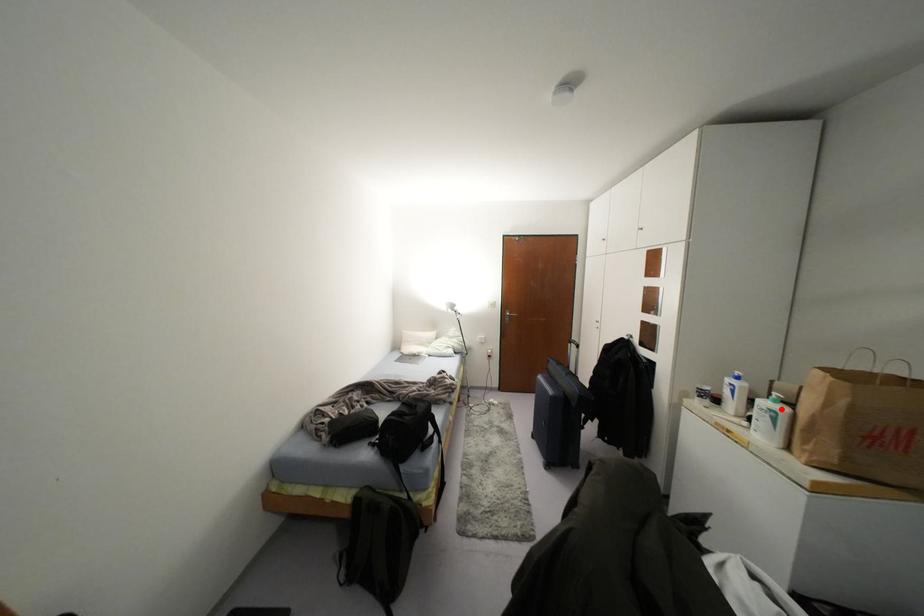
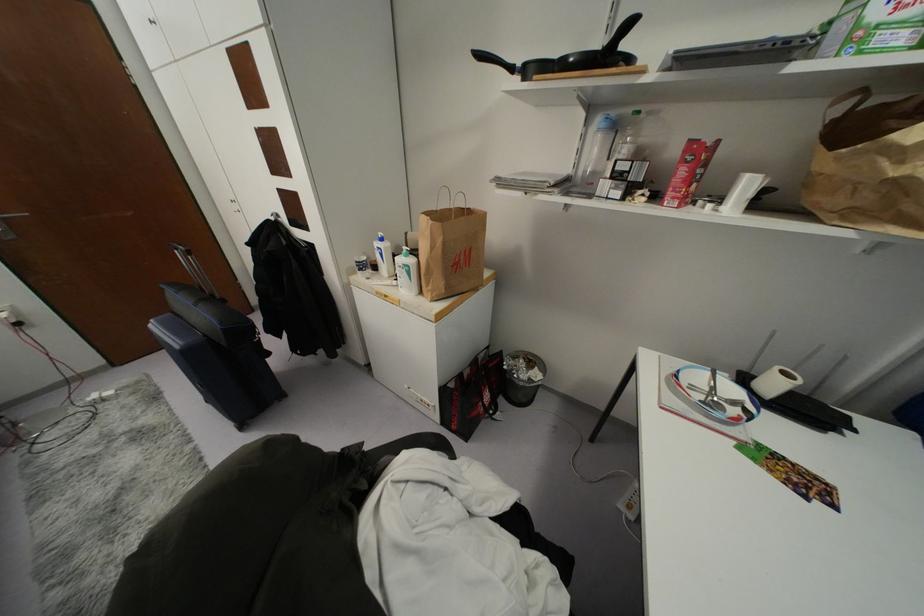
Find the pixel in the second image that matches the highlighted location in the first image.

(410, 261)